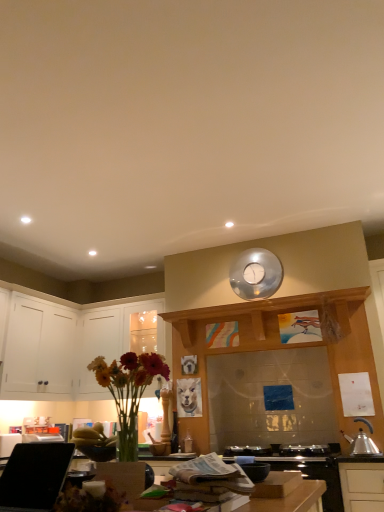
Question: From the image's perspective, is white matte cabinet at left, the second cabinetry in the right-to-left sequence, over matte glass vase with flowers at lower left?

Choices:
 (A) no
 (B) yes

Answer: (A)

Question: From a real-world perspective, is white matte cabinet at left, acting as the 1th cabinetry starting from the left, on matte glass vase with flowers at lower left?

Choices:
 (A) no
 (B) yes

Answer: (B)

Question: Is white matte cabinet at left, the second cabinetry in the right-to-left sequence, turned away from matte glass vase with flowers at lower left?

Choices:
 (A) no
 (B) yes

Answer: (A)

Question: Does white matte cabinet at left, the second cabinetry in the right-to-left sequence, come behind matte glass vase with flowers at lower left?

Choices:
 (A) no
 (B) yes

Answer: (B)

Question: Is matte glass vase with flowers at lower left completely or partially inside white matte cabinet at left, acting as the 1th cabinetry starting from the left?

Choices:
 (A) yes
 (B) no

Answer: (B)

Question: Considering the relative sizes of white matte cabinet at left, the second cabinetry in the right-to-left sequence, and matte glass vase with flowers at lower left in the image provided, is white matte cabinet at left, the second cabinetry in the right-to-left sequence, shorter than matte glass vase with flowers at lower left?

Choices:
 (A) no
 (B) yes

Answer: (A)

Question: Is the position of matte glass vase with flowers at lower left less distant than that of white glossy cabinets at left, which ranks as the second cabinetry in left-to-right order?

Choices:
 (A) yes
 (B) no

Answer: (A)

Question: Is matte glass vase with flowers at lower left positioned beyond the bounds of white glossy cabinets at left, which ranks as the second cabinetry in left-to-right order?

Choices:
 (A) yes
 (B) no

Answer: (A)

Question: Would you consider matte glass vase with flowers at lower left to be distant from white glossy cabinets at left, which ranks as the second cabinetry in left-to-right order?

Choices:
 (A) no
 (B) yes

Answer: (B)

Question: Is matte glass vase with flowers at lower left wider than white glossy cabinets at left, the first cabinetry in the right-to-left sequence?

Choices:
 (A) no
 (B) yes

Answer: (A)

Question: Could white glossy cabinets at left, which ranks as the second cabinetry in left-to-right order, be considered to be inside matte glass vase with flowers at lower left?

Choices:
 (A) yes
 (B) no

Answer: (B)

Question: Can you confirm if matte glass vase with flowers at lower left is smaller than white glossy cabinets at left, which ranks as the second cabinetry in left-to-right order?

Choices:
 (A) no
 (B) yes

Answer: (B)

Question: Does white glossy cabinets at left, which ranks as the second cabinetry in left-to-right order, have a lesser width compared to wooden surface at center?

Choices:
 (A) yes
 (B) no

Answer: (B)